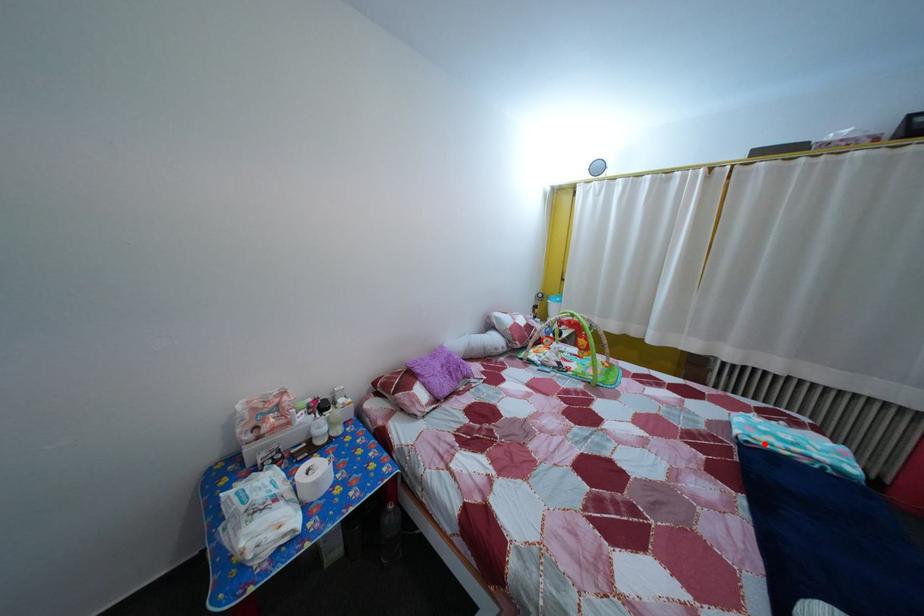
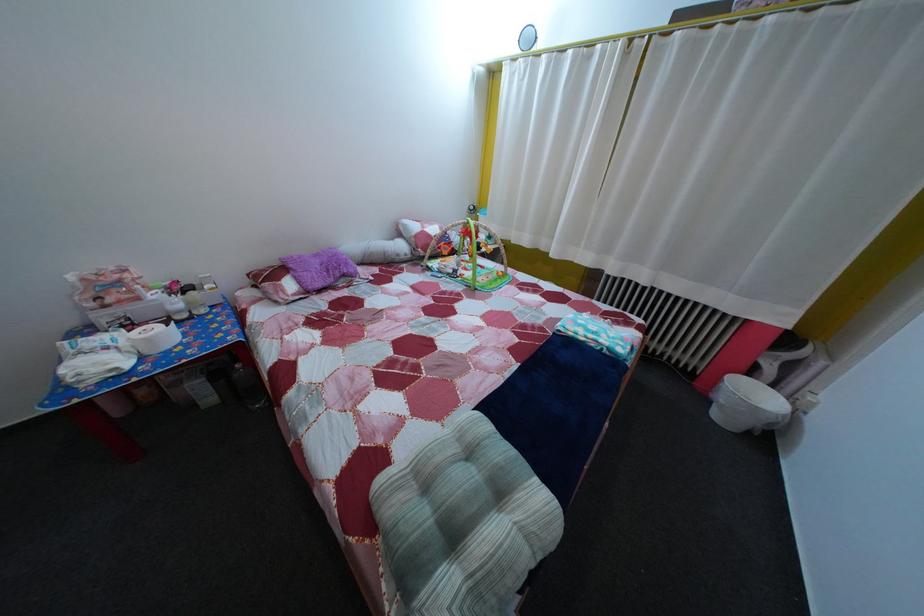
Question: I am providing you with two images of the same scene from different viewpoints. Image1 has a red point marked. In image2, the corresponding 3D location appears at what relative position? Reply with the corresponding letter.

Choices:
 (A) Closer
 (B) Farther

Answer: (A)